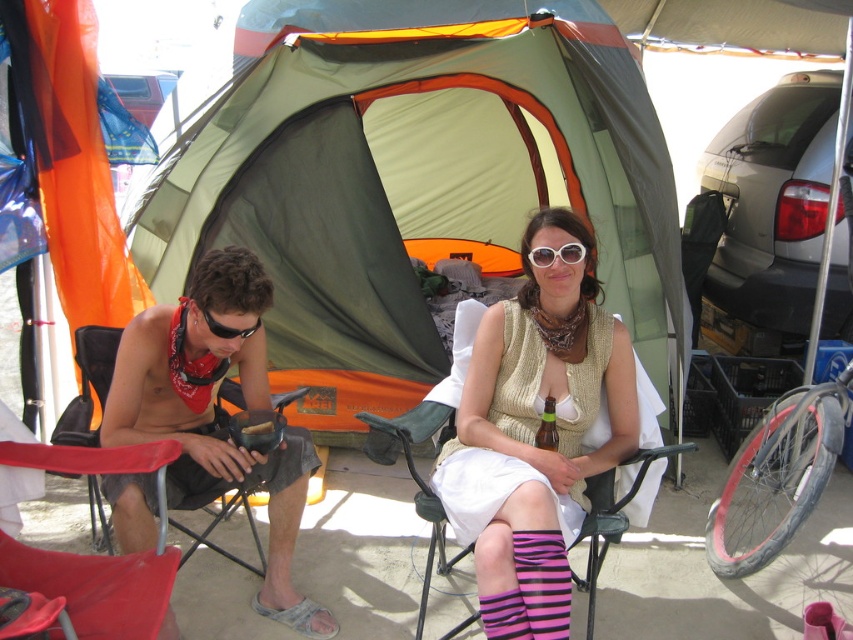
You are standing at the origin point of the coordinate system in this camping scene. You need to place a new object at the same position as the matte red folding chair at lower left. What are the coordinates where you should place the new object?

The coordinates for the matte red folding chair at lower left are at point (97,584). Therefore, you should place the new object at coordinates (97,584).

What is the exact 2D coordinate of the white knitted vest at center in the image?

The white knitted vest at center is located at the 2D coordinate point of (537, 429).